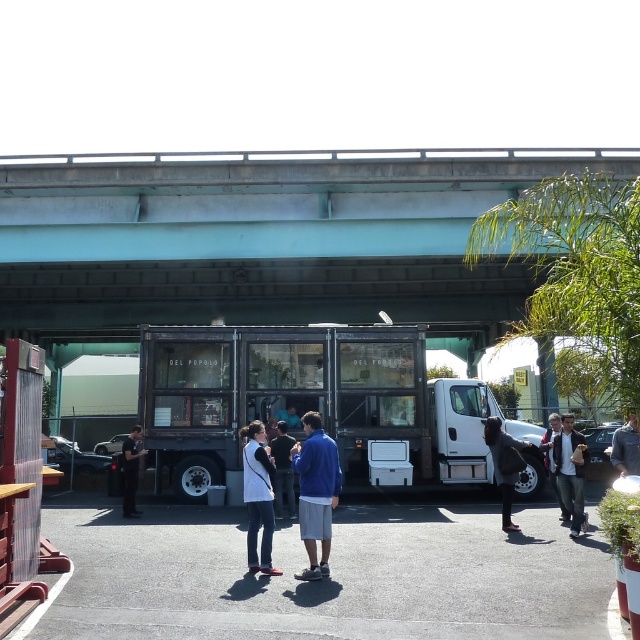
Question: Does white matte vest at center appear on the right side of denim jacket at center?

Choices:
 (A) no
 (B) yes

Answer: (A)

Question: Which is farther from the dark gray fur at center?

Choices:
 (A) blue cotton shirt at center
 (B) wooden panel food truck at center

Answer: (A)

Question: Observing the image, what is the correct spatial positioning of white matte jacket at center in reference to blue denim jacket at center?

Choices:
 (A) right
 (B) left

Answer: (B)

Question: Can you confirm if white matte vest at center is bigger than denim jacket at center?

Choices:
 (A) no
 (B) yes

Answer: (B)

Question: Which of the following is the farthest from the observer?

Choices:
 (A) (552, 442)
 (B) (440, 282)
 (C) (252, 541)

Answer: (B)

Question: Which of the following is the farthest from the observer?

Choices:
 (A) gray wool sweater at center
 (B) wooden panel food truck at center
 (C) black leather jacket at center
 (D) dark gray fur at center

Answer: (B)